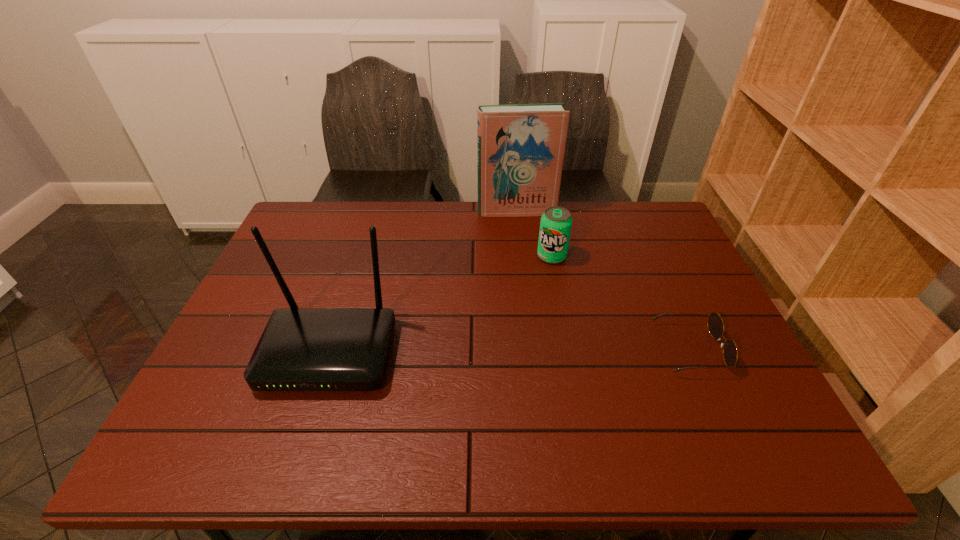
Locate an element on the screen. The image size is (960, 540). free space that is in between the router and the shortest object is located at coordinates (510, 351).

Identify the location of free space between the pop soda and the farthest object. (534, 234).

Find the location of a particular element. The width and height of the screenshot is (960, 540). free area in between the third tallest object and the shortest object is located at coordinates (621, 302).

Locate an element on the screen. The image size is (960, 540). empty space that is in between the tallest object and the second shortest object is located at coordinates (534, 234).

The height and width of the screenshot is (540, 960). I want to click on vacant space in between the second farthest object and the hardback book, so click(x=534, y=234).

Locate an element on the screen. This screenshot has height=540, width=960. free area in between the second farthest object and the farthest object is located at coordinates [x=534, y=234].

Find the location of a particular element. free space between the shortest object and the second tallest object is located at coordinates (x=510, y=351).

I want to click on object identified as the third closest to the second tallest object, so click(x=715, y=324).

This screenshot has width=960, height=540. Identify the location of the third closest object to the third shortest object. (715, 324).

Find the location of a particular element. This screenshot has width=960, height=540. vacant area that satisfies the following two spatial constraints: 1. on the front side of the tallest object; 2. on the lenses of the sunglasses is located at coordinates (532, 349).